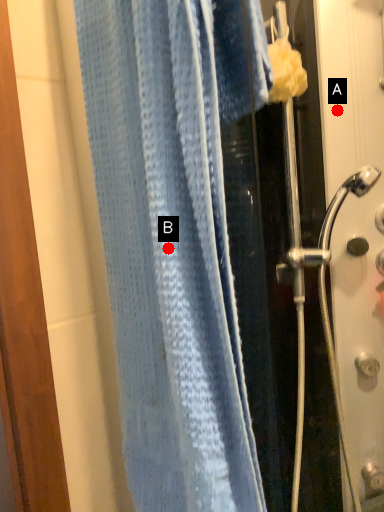
Question: Two points are circled on the image, labeled by A and B beside each circle. Which point is closer to the camera taking this photo?

Choices:
 (A) A is closer
 (B) B is closer

Answer: (B)